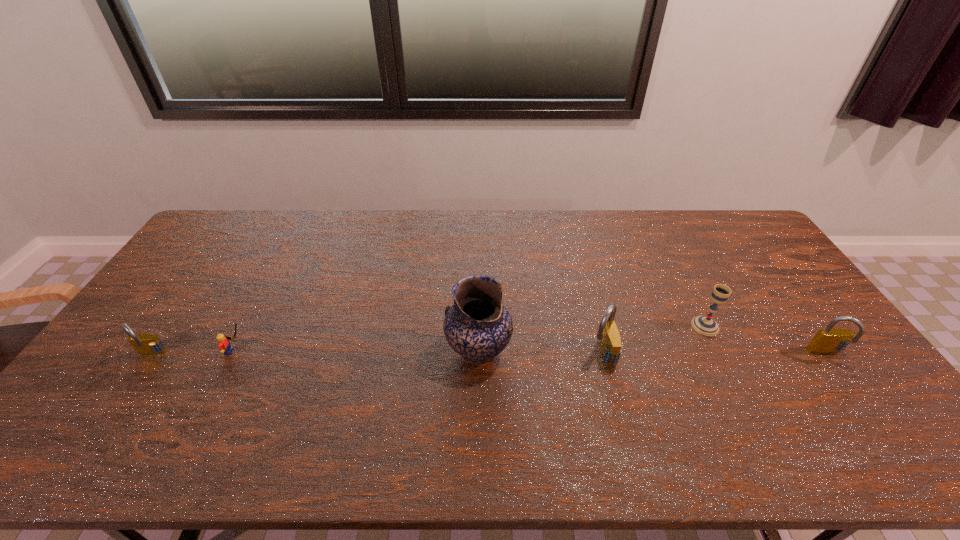
This screenshot has width=960, height=540. I want to click on blank space at the far edge of the desktop, so click(x=513, y=245).

In the image, there is a desktop. Where is `vacant space at the near edge`? vacant space at the near edge is located at coordinates (733, 420).

Locate an element on the screen. vacant space at the left edge of the desktop is located at coordinates (169, 311).

Locate an element on the screen. This screenshot has width=960, height=540. free space at the far right corner of the desktop is located at coordinates (733, 241).

Find the location of a particular element. The image size is (960, 540). vacant area that lies between the fourth object from left to right and the fourth object from right to left is located at coordinates (540, 353).

What are the coordinates of `blank region between the fifth object from right to left and the pottery` in the screenshot? It's located at (357, 352).

Where is `unoccupied area between the rightmost object and the Lego`? The image size is (960, 540). unoccupied area between the rightmost object and the Lego is located at coordinates (531, 353).

You are a GUI agent. You are given a task and a screenshot of the screen. Output one action in this format:
    pyautogui.click(x=<x>, y=<y>)
    Task: Click on the unoccupied position between the chalice and the second shortest object
    
    Given the screenshot: What is the action you would take?
    pyautogui.click(x=428, y=341)

At what (x,y) coordinates should I click in order to perform the action: click on empty space that is in between the third object from right to left and the leftmost padlock. Please return your answer as a coordinate pair (x, y). Looking at the image, I should click on (376, 355).

You are a GUI agent. You are given a task and a screenshot of the screen. Output one action in this format:
    pyautogui.click(x=<x>, y=<y>)
    Task: Click on the free spot between the pottery and the second object from left to right
    The image size is (960, 540).
    Given the screenshot: What is the action you would take?
    pyautogui.click(x=357, y=352)